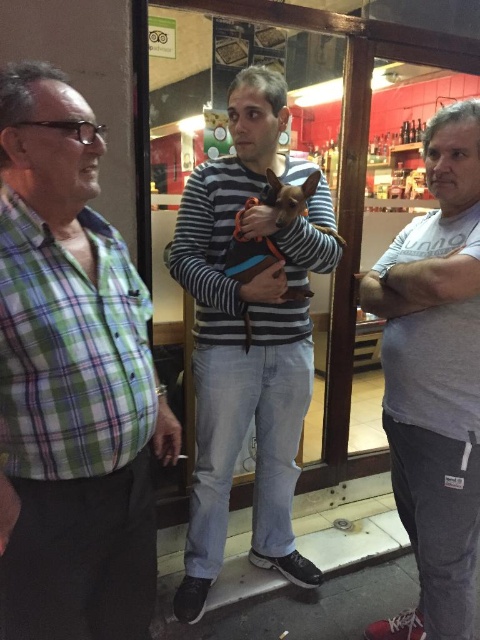
Looking at this image, you are a delivery robot with a width of 1 meter. You need to navigate through the space between the skinny jeans at center and the camera. Can you fit through this space?

The distance between the skinny jeans at center and the camera is 1.33 meters, so the delivery robot with a width of 1 meter can fit through the space since it is wider than the robot.

Based on the scene description, where is the skinny jeans at center located in terms of coordinates?

The skinny jeans at center are located at point (x=420, y=280).